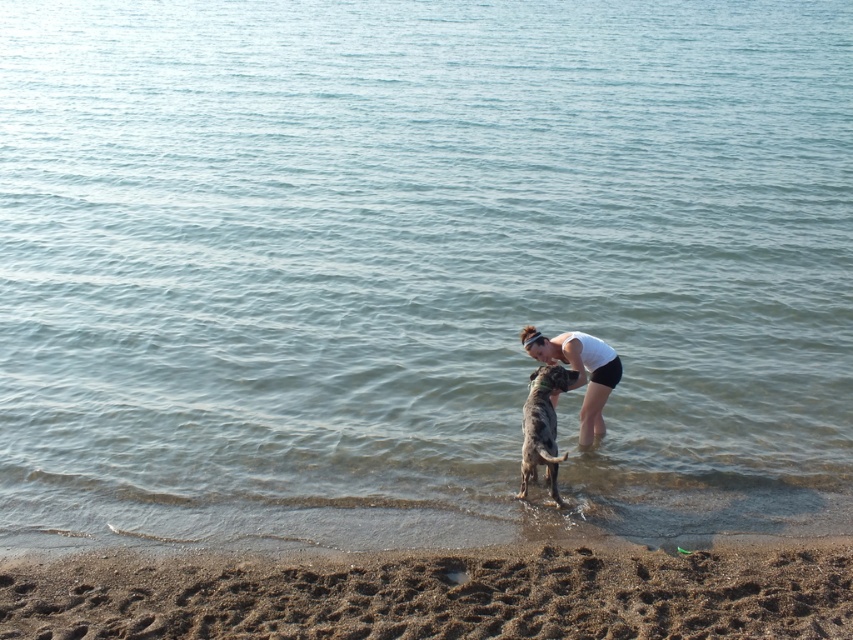
Question: Which object is positioned farthest from the white matte shirt at center?

Choices:
 (A) speckled fur dog at center
 (B) brown sandy mud at lower center

Answer: (B)

Question: Can you confirm if brown sandy mud at lower center is thinner than white matte shirt at center?

Choices:
 (A) yes
 (B) no

Answer: (B)

Question: Which point is farther to the camera?

Choices:
 (A) (601, 424)
 (B) (548, 396)
 (C) (824, 563)

Answer: (A)

Question: Which point is farther to the camera?

Choices:
 (A) white matte shirt at center
 (B) brown sandy mud at lower center

Answer: (A)

Question: Does brown sandy mud at lower center have a larger size compared to speckled fur dog at center?

Choices:
 (A) no
 (B) yes

Answer: (B)

Question: Does white matte shirt at center appear on the left side of speckled fur dog at center?

Choices:
 (A) no
 (B) yes

Answer: (A)